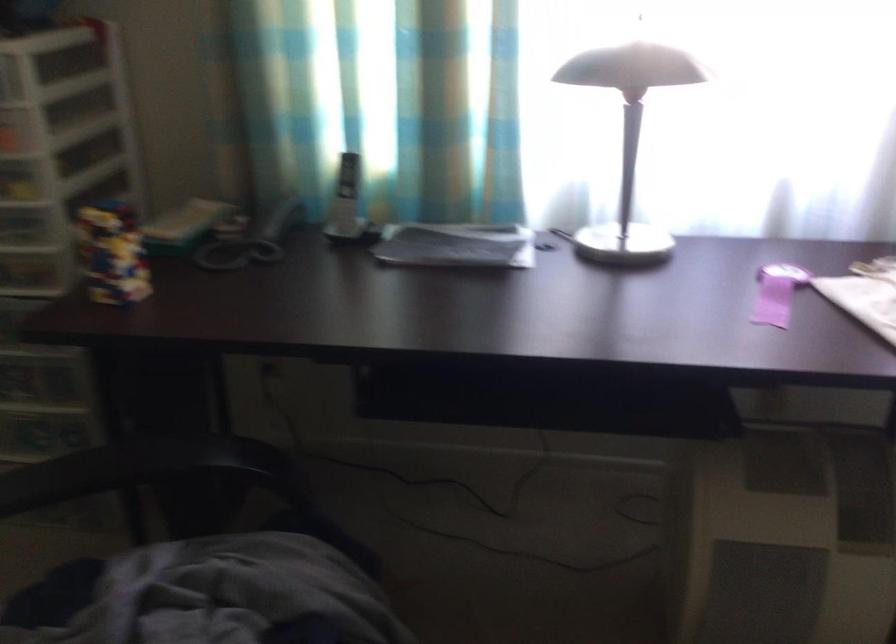
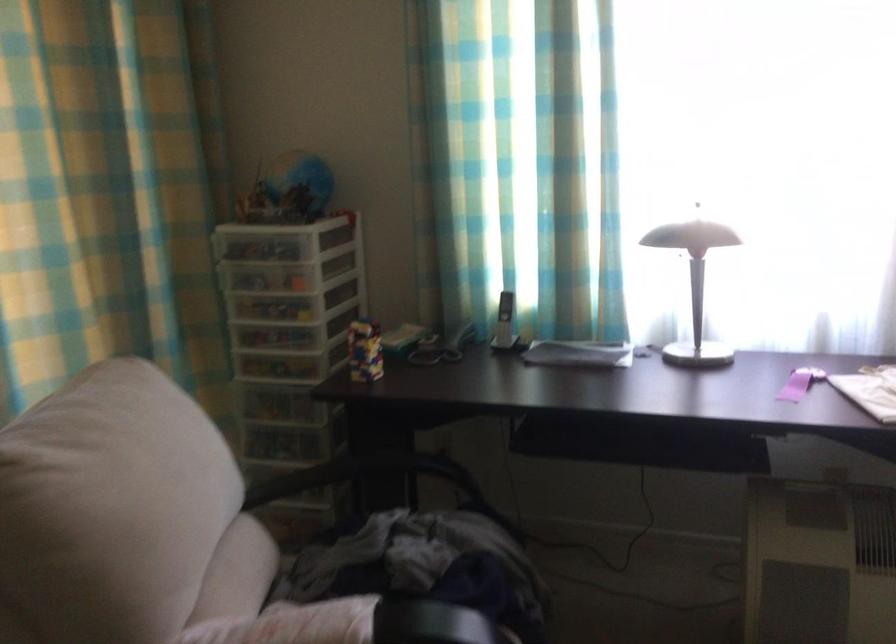
In the second image, find the point that corresponds to pixel 119 252 in the first image.

(365, 351)